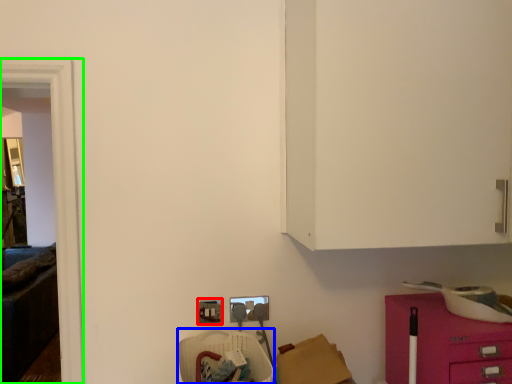
Question: Which object is positioned farthest from electric outlet (highlighted by a red box)? Select from armchair (highlighted by a blue box) and glass door (highlighted by a green box).

Choices:
 (A) armchair
 (B) glass door

Answer: (B)